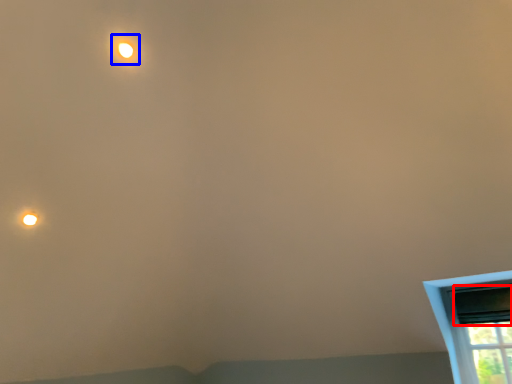
Question: Which of the following is the closest to the observer, window screen (highlighted by a red box) or light (highlighted by a blue box)?

Choices:
 (A) window screen
 (B) light

Answer: (B)